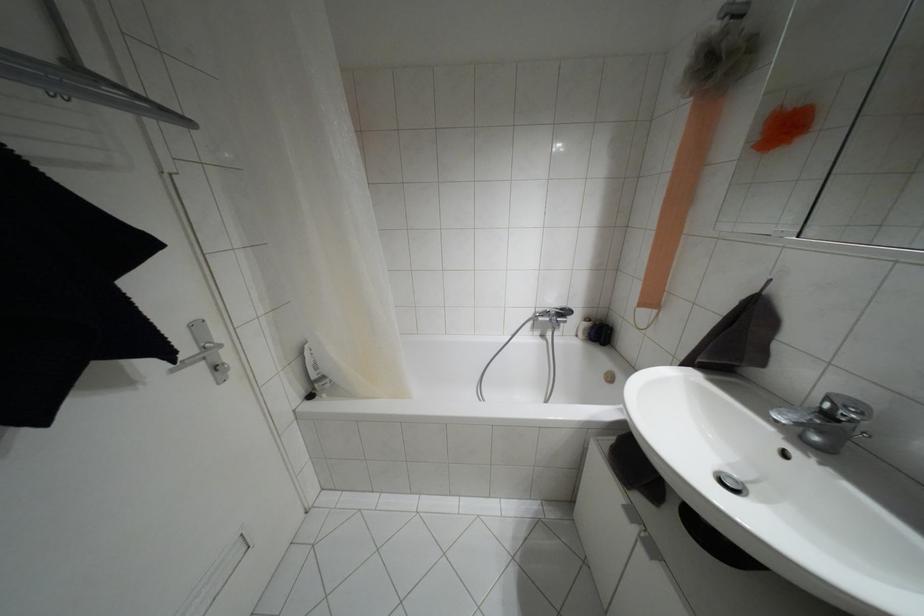
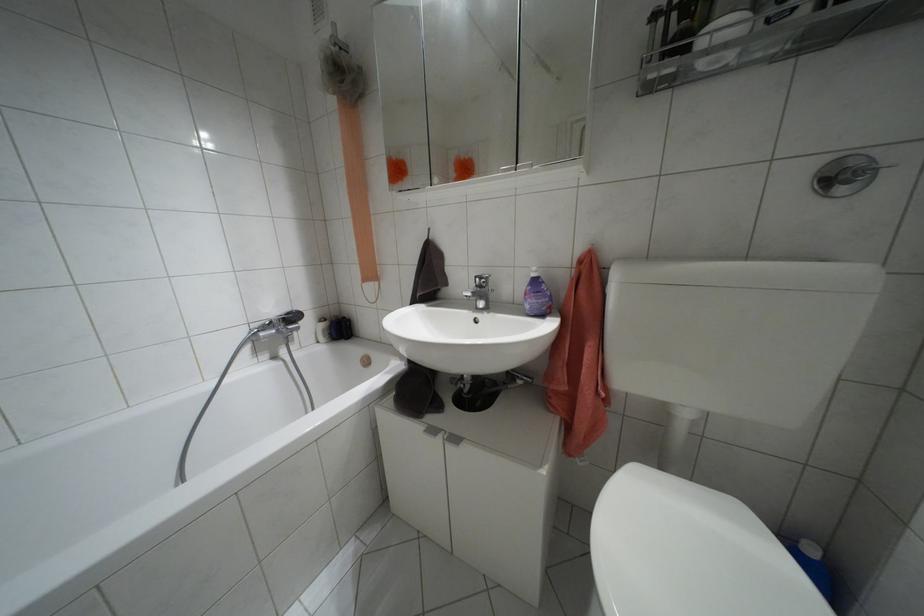
Where in the second image is the point corresponding to the point at 561,309 from the first image?

(286, 313)